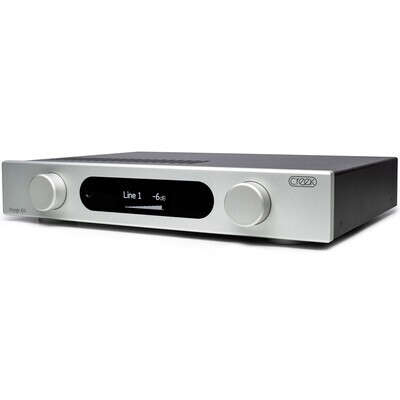
The width and height of the screenshot is (400, 400). I want to click on volume sliders, so click(x=159, y=204).